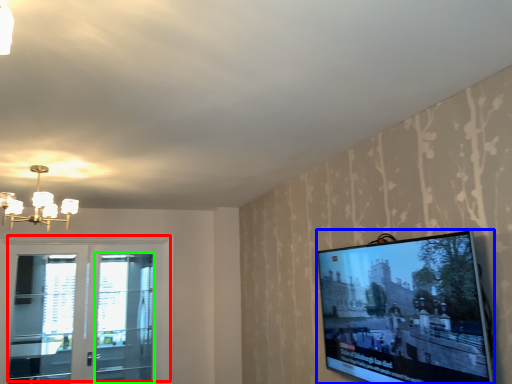
Question: Based on their relative distances, which object is nearer to window (highlighted by a red box)? Choose from television (highlighted by a blue box) and screen door (highlighted by a green box).

Choices:
 (A) television
 (B) screen door

Answer: (B)